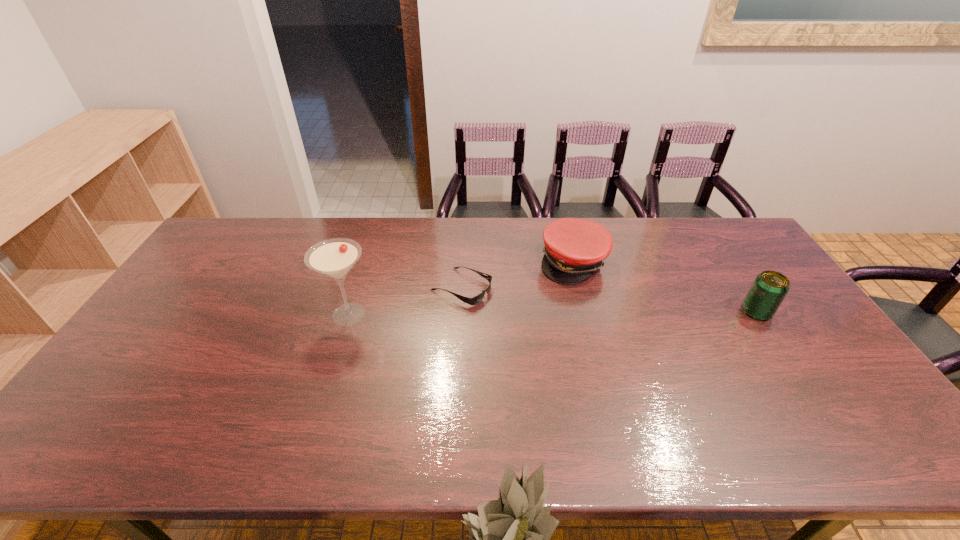
Where is `free space on the desktop that is between the martini and the rightmost object and is positioned on the front-facing side of the second object from left to right`? free space on the desktop that is between the martini and the rightmost object and is positioned on the front-facing side of the second object from left to right is located at coordinates (521, 313).

Where is `vacant space on the desktop that is between the martini and the beer can and is positioned on the front-facing side of the cap`? vacant space on the desktop that is between the martini and the beer can and is positioned on the front-facing side of the cap is located at coordinates (607, 313).